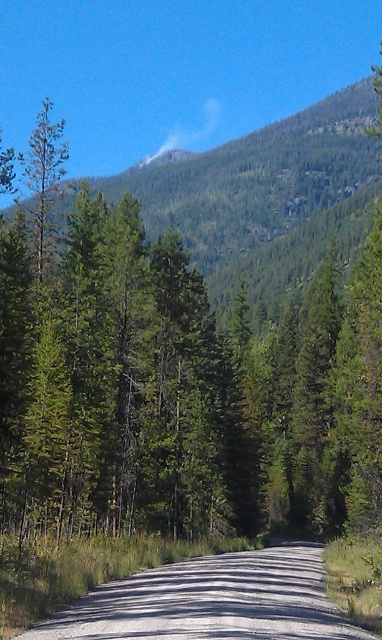
Between point (307, 113) and point (118, 611), which one is positioned in front?

Positioned in front is point (118, 611).

Is point (236, 228) farther from camera compared to point (320, 605)?

Yes, it is behind point (320, 605).

I want to click on green forested mountain at upper center, so click(267, 195).